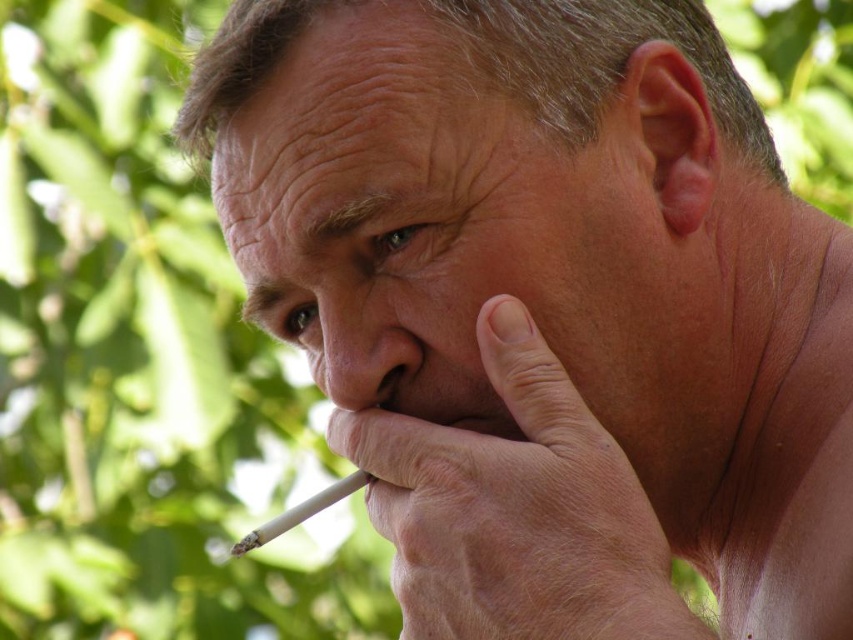
Question: Can you confirm if green leafy tree at left is positioned above white matte cigarette at lower center?

Choices:
 (A) no
 (B) yes

Answer: (B)

Question: Is green leafy tree at left in front of white matte cigarette at lower center?

Choices:
 (A) no
 (B) yes

Answer: (A)

Question: Can you confirm if green leafy tree at left is wider than white matte cigarette at lower center?

Choices:
 (A) no
 (B) yes

Answer: (B)

Question: Which point is farther to the camera?

Choices:
 (A) pos(260,540)
 (B) pos(173,29)

Answer: (B)